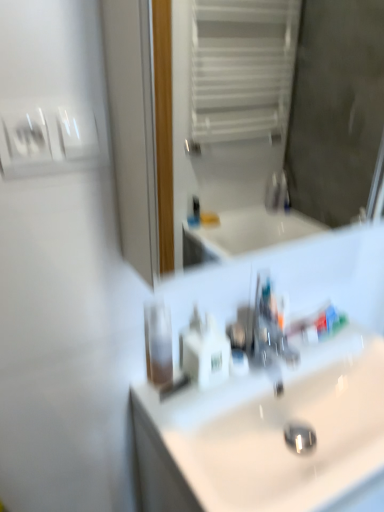
Question: From a real-world perspective, is transparent plastic mouthwash at center physically located above or below white glossy mirror at upper center?

Choices:
 (A) above
 (B) below

Answer: (B)

Question: In terms of height, does transparent plastic mouthwash at center look taller or shorter compared to white glossy mirror at upper center?

Choices:
 (A) short
 (B) tall

Answer: (A)

Question: Which is farther from the white glossy mirror at upper center?

Choices:
 (A) white glossy light switch at upper left
 (B) white glossy sink at center
 (C) transparent plastic mouthwash at center
 (D) white plastic soap dispenser at center
 (E) white glossy toothpaste at center

Answer: (A)

Question: Estimate the real-world distances between objects in this image. Which object is farther from the white glossy light switch at upper left?

Choices:
 (A) white glossy toothpaste at center
 (B) white glossy mirror at upper center
 (C) transparent plastic mouthwash at center
 (D) white glossy sink at center
 (E) white plastic soap dispenser at center

Answer: (B)